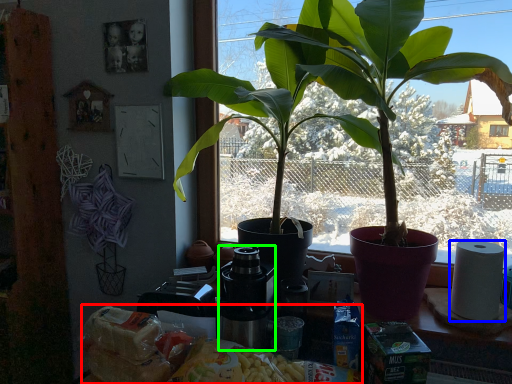
Question: Based on their relative distances, which object is nearer to food (highlighted by a red box)? Choose from paper towel (highlighted by a blue box) and coffee machine (highlighted by a green box).

Choices:
 (A) paper towel
 (B) coffee machine

Answer: (B)